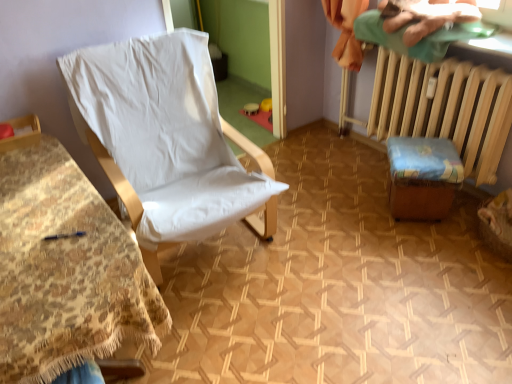
Locate an element on the screen. Image resolution: width=512 pixels, height=384 pixels. vacant region in front of wooden radiator at right is located at coordinates (390, 253).